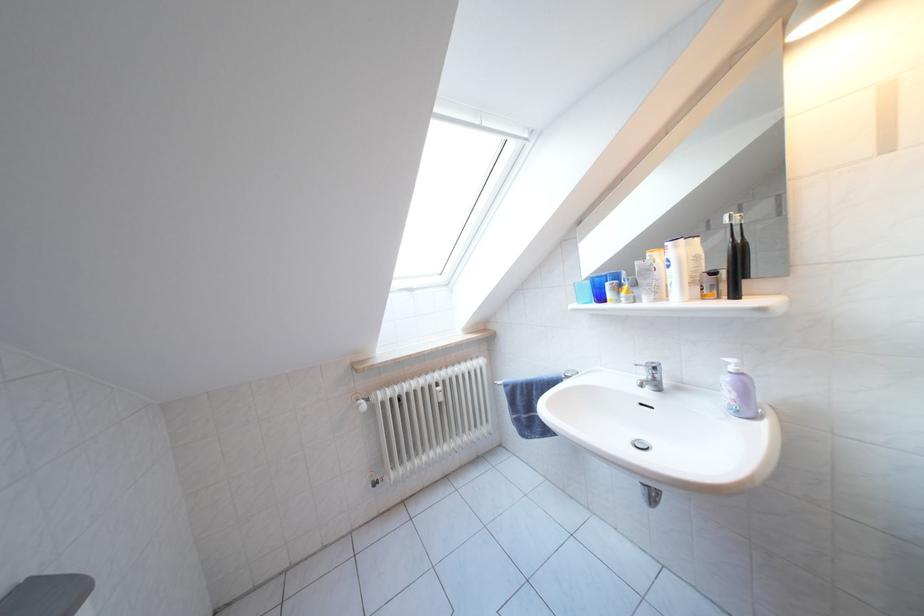
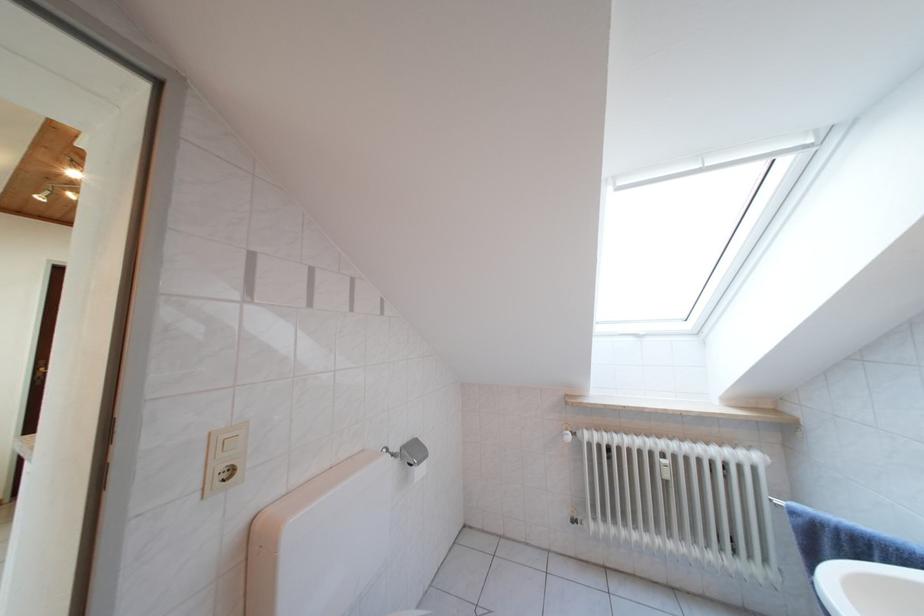
Question: The images are taken continuously from a first-person perspective. In which direction is your viewpoint rotating?

Choices:
 (A) Left
 (B) Right
 (C) Up
 (D) Down

Answer: (A)